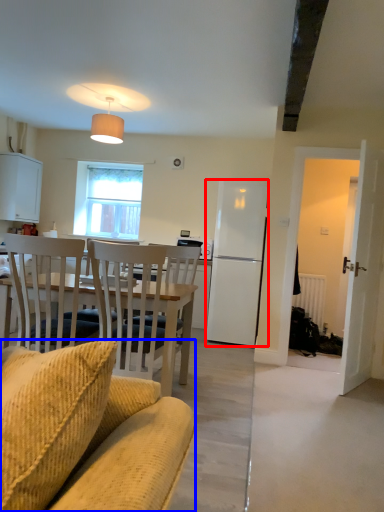
Question: Which of the following is the farthest to the observer, refrigerator (highlighted by a red box) or chair (highlighted by a blue box)?

Choices:
 (A) refrigerator
 (B) chair

Answer: (A)